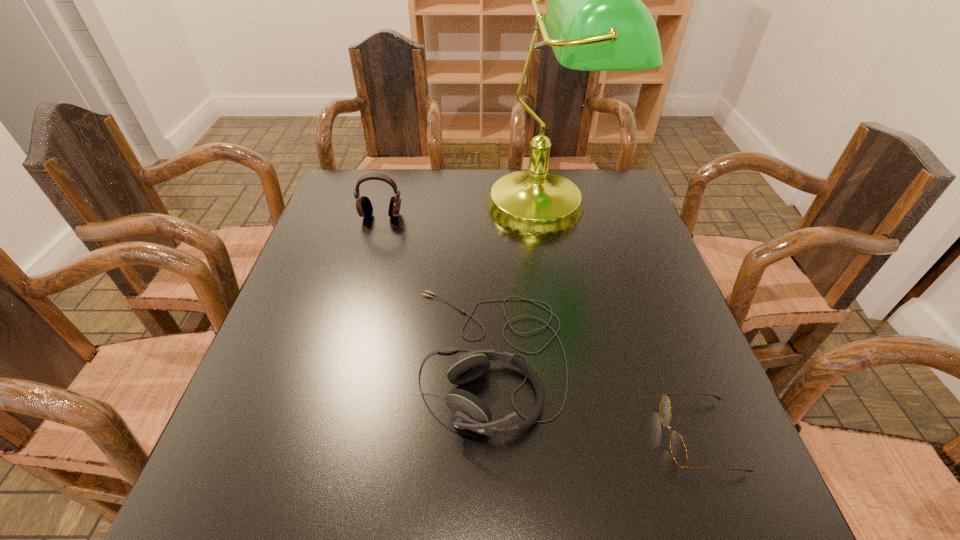
Identify the location of object that is positioned at the far left corner. (364, 207).

This screenshot has width=960, height=540. I want to click on object that is positioned at the far right corner, so click(595, 21).

Find the location of a particular element. This screenshot has width=960, height=540. object that is at the near right corner is located at coordinates (678, 449).

You are a GUI agent. You are given a task and a screenshot of the screen. Output one action in this format:
    pyautogui.click(x=<x>, y=<y>)
    Task: Click on the free location at the far edge
    
    Given the screenshot: What is the action you would take?
    pyautogui.click(x=431, y=197)

Where is `vacant space at the near edge of the desktop`? This screenshot has height=540, width=960. vacant space at the near edge of the desktop is located at coordinates (388, 528).

In the image, there is a desktop. Identify the location of vacant space at the left edge. Image resolution: width=960 pixels, height=540 pixels. (270, 329).

Locate an element on the screen. The image size is (960, 540). vacant area at the right edge of the desktop is located at coordinates (617, 224).

Identify the location of vacant space at the far left corner. Image resolution: width=960 pixels, height=540 pixels. (360, 177).

The image size is (960, 540). Find the location of `free region at the near left corner`. free region at the near left corner is located at coordinates pos(225,524).

The image size is (960, 540). I want to click on vacant space at the far right corner of the desktop, so click(586, 198).